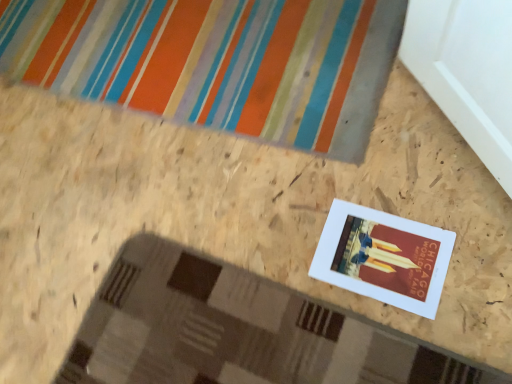
Measure the distance between multicolored striped bath mat at upper center and camera.

The depth of multicolored striped bath mat at upper center is 1.12 meters.

What do you see at coordinates (217, 62) in the screenshot?
I see `multicolored striped bath mat at upper center` at bounding box center [217, 62].

In order to face multicolored striped bath mat at upper center, should I rotate leftwards or rightwards?

To align with it, rotate left about 12.713°.

Where is `multicolored striped bath mat at upper center`? This screenshot has width=512, height=384. multicolored striped bath mat at upper center is located at coordinates (217, 62).

The height and width of the screenshot is (384, 512). I want to click on white matte picture frame at center, so click(x=384, y=257).

The image size is (512, 384). Describe the element at coordinates (384, 257) in the screenshot. I see `white matte picture frame at center` at that location.

Find the location of a particular element. This screenshot has width=512, height=384. multicolored striped bath mat at upper center is located at coordinates (217, 62).

Between white matte picture frame at center and multicolored striped bath mat at upper center, which one appears on the right side from the viewer's perspective?

white matte picture frame at center.

Considering the positions of objects white matte picture frame at center and multicolored striped bath mat at upper center in the image provided, who is in front, white matte picture frame at center or multicolored striped bath mat at upper center?

white matte picture frame at center.

Is point (371, 247) behind point (146, 7)?

That is False.

From the image's perspective, is white matte picture frame at center positioned above or below multicolored striped bath mat at upper center?

From the image's perspective, white matte picture frame at center appears below multicolored striped bath mat at upper center.

From a real-world perspective, is white matte picture frame at center above or below multicolored striped bath mat at upper center?

In terms of real-world spatial position, white matte picture frame at center is below multicolored striped bath mat at upper center.

Does white matte picture frame at center have a greater width compared to multicolored striped bath mat at upper center?

No, white matte picture frame at center is not wider than multicolored striped bath mat at upper center.

Considering the relative sizes of white matte picture frame at center and multicolored striped bath mat at upper center in the image provided, is white matte picture frame at center shorter than multicolored striped bath mat at upper center?

Yes, white matte picture frame at center is shorter than multicolored striped bath mat at upper center.

Consider the image. Who is smaller, white matte picture frame at center or multicolored striped bath mat at upper center?

white matte picture frame at center.

Would you say multicolored striped bath mat at upper center is part of white matte picture frame at center's contents?

No.

Based on the photo, is white matte picture frame at center placed right next to multicolored striped bath mat at upper center?

There is a gap between white matte picture frame at center and multicolored striped bath mat at upper center.

Is white matte picture frame at center oriented towards multicolored striped bath mat at upper center?

No, white matte picture frame at center is not turned towards multicolored striped bath mat at upper center.

Where is `bath mat that is behind the white matte picture frame at center`? The image size is (512, 384). bath mat that is behind the white matte picture frame at center is located at coordinates (217, 62).

Considering the relative positions of multicolored striped bath mat at upper center and white matte picture frame at center in the image provided, is multicolored striped bath mat at upper center to the right of white matte picture frame at center from the viewer's perspective?

No.

Is multicolored striped bath mat at upper center closer to the viewer compared to white matte picture frame at center?

No, multicolored striped bath mat at upper center is behind white matte picture frame at center.

Between point (296, 47) and point (359, 284), which one is positioned in front?

The point (359, 284) is in front.

From the image's perspective, is multicolored striped bath mat at upper center above or below white matte picture frame at center?

multicolored striped bath mat at upper center is above white matte picture frame at center.

From a real-world perspective, is multicolored striped bath mat at upper center physically located above or below white matte picture frame at center?

multicolored striped bath mat at upper center is situated higher than white matte picture frame at center in the real world.

Between multicolored striped bath mat at upper center and white matte picture frame at center, which one has smaller width?

With smaller width is white matte picture frame at center.

Between multicolored striped bath mat at upper center and white matte picture frame at center, which one has less height?

white matte picture frame at center is shorter.

Between multicolored striped bath mat at upper center and white matte picture frame at center, which one has smaller size?

white matte picture frame at center.

Is multicolored striped bath mat at upper center situated inside white matte picture frame at center or outside?

multicolored striped bath mat at upper center is outside white matte picture frame at center.

Is multicolored striped bath mat at upper center far from white matte picture frame at center?

No.

Is multicolored striped bath mat at upper center positioned with its back to white matte picture frame at center?

That's not correct — multicolored striped bath mat at upper center is not looking away from white matte picture frame at center.

How many degrees apart are the facing directions of multicolored striped bath mat at upper center and white matte picture frame at center?

0.000346 degrees.

Find the location of a particular element. This screenshot has width=512, height=384. bath mat located behind the white matte picture frame at center is located at coordinates (217, 62).

Find the location of a particular element. bath mat above the white matte picture frame at center (from a real-world perspective) is located at coordinates (217, 62).

In order to click on bath mat on the left of white matte picture frame at center in this screenshot , I will do `click(217, 62)`.